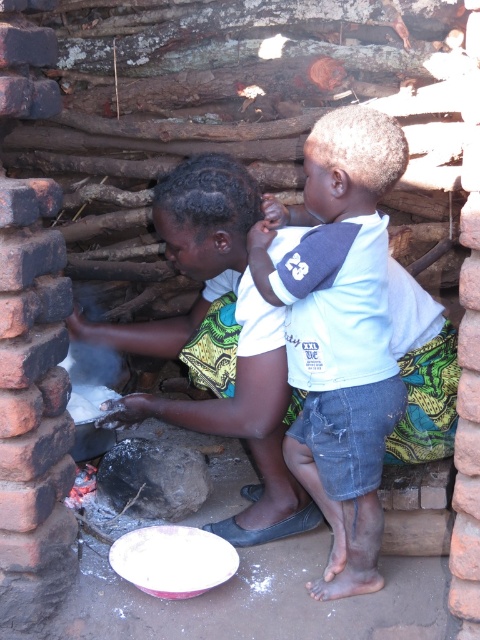
You are a visitor entering the hut and see the green printed fabric at center and the white cotton shirt at center. Which object is closer to you?

The green printed fabric at center is closer to you because the white cotton shirt at center is behind it.

You are organizing a small space in the mud hut and need to place both the green printed fabric at center and the white cotton shirt at center. Since space is limited, which item should you choose to store first if you want to prioritize the larger item?

The green printed fabric at center should be stored first because it has a larger size compared to the white cotton shirt at center.